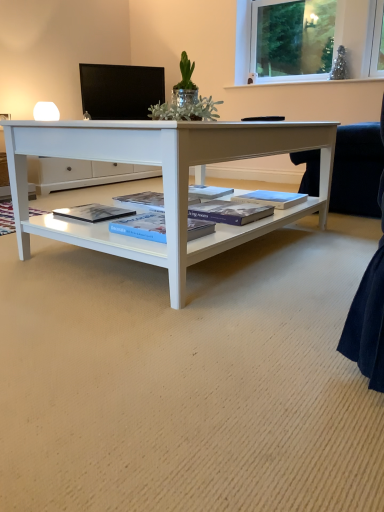
In order to face matte black book at center, which is the 1th magazine in left-to-right order, should I rotate leftwards or rightwards?

Turn left approximately 12.759 degrees to face it.

What do you see at coordinates (272, 198) in the screenshot? The image size is (384, 512). I see `matte blue magazine at center, which ranks as the 4th magazine in left-to-right order` at bounding box center [272, 198].

Find the location of a particular element. The height and width of the screenshot is (512, 384). matte blue magazine at center, which ranks as the 4th magazine in left-to-right order is located at coordinates (272, 198).

How much space does blue glossy book at center, which appears as the 3th magazine when viewed from the right, occupy horizontally?

blue glossy book at center, which appears as the 3th magazine when viewed from the right, is 11.70 inches wide.

The width and height of the screenshot is (384, 512). Find the location of `blue matte book at center, which is counted as the third magazine, starting from the left`. blue matte book at center, which is counted as the third magazine, starting from the left is located at coordinates (229, 212).

At what (x,y) coordinates should I click in order to perform the action: click on matte black book at center, which is the 4th magazine in right-to-left order. Please return your answer as a coordinate pair (x, y). Image resolution: width=384 pixels, height=512 pixels. Looking at the image, I should click on (94, 212).

Is point (88, 71) behind point (121, 226)?

Yes, it is.

There is a black glossy monitor at upper center. Identify the location of the 4th magazine below it (from the image's perspective). The image size is (384, 512). (142, 226).

Is black glossy monitor at upper center taller than blue glossy book at center, which appears as the 3th magazine when viewed from the right?

Yes.

Which object is closer to the camera taking this photo, matte blue magazine at center, which ranks as the first magazine in right-to-left order, or matte black book at center, which is the 4th magazine in right-to-left order?

matte black book at center, which is the 4th magazine in right-to-left order, is more forward.

Looking at this image, could you measure the distance between matte blue magazine at center, which ranks as the 4th magazine in left-to-right order, and matte black book at center, which is the 4th magazine in right-to-left order?

matte blue magazine at center, which ranks as the 4th magazine in left-to-right order, and matte black book at center, which is the 4th magazine in right-to-left order, are 25.66 inches apart from each other.

Between point (267, 198) and point (85, 213), which one is positioned in front?

The point (85, 213) is closer to the camera.

Could matte black book at center, which is the 4th magazine in right-to-left order, be considered to be inside matte blue magazine at center, which ranks as the first magazine in right-to-left order?

No, matte black book at center, which is the 4th magazine in right-to-left order, is located outside of matte blue magazine at center, which ranks as the first magazine in right-to-left order.

Is matte blue magazine at center, which ranks as the first magazine in right-to-left order, looking in the opposite direction of blue glossy book at center, which appears as the 3th magazine when viewed from the right?

That's not correct — matte blue magazine at center, which ranks as the first magazine in right-to-left order, is not looking away from blue glossy book at center, which appears as the 3th magazine when viewed from the right.

Considering the sizes of matte blue magazine at center, which ranks as the first magazine in right-to-left order, and blue glossy book at center, which ranks as the 2th magazine in left-to-right order, in the image, is matte blue magazine at center, which ranks as the first magazine in right-to-left order, taller or shorter than blue glossy book at center, which ranks as the 2th magazine in left-to-right order,?

matte blue magazine at center, which ranks as the first magazine in right-to-left order, is shorter than blue glossy book at center, which ranks as the 2th magazine in left-to-right order.

From the image's perspective, is matte blue magazine at center, which ranks as the 4th magazine in left-to-right order, positioned above or below blue glossy book at center, which appears as the 3th magazine when viewed from the right?

From the image's perspective, matte blue magazine at center, which ranks as the 4th magazine in left-to-right order, appears above blue glossy book at center, which appears as the 3th magazine when viewed from the right.

Who is bigger, matte blue magazine at center, which ranks as the 4th magazine in left-to-right order, or blue glossy book at center, which ranks as the 2th magazine in left-to-right order?

blue glossy book at center, which ranks as the 2th magazine in left-to-right order.

Which is in front, blue matte book at center, acting as the 2th magazine starting from the right, or blue glossy book at center, which ranks as the 2th magazine in left-to-right order?

blue glossy book at center, which ranks as the 2th magazine in left-to-right order, is in front.

Is blue matte book at center, which is counted as the third magazine, starting from the left, facing towards blue glossy book at center, which ranks as the 2th magazine in left-to-right order?

No, blue matte book at center, which is counted as the third magazine, starting from the left, is not aimed at blue glossy book at center, which ranks as the 2th magazine in left-to-right order.

Which of these two, blue matte book at center, acting as the 2th magazine starting from the right, or blue glossy book at center, which ranks as the 2th magazine in left-to-right order, is smaller?

blue matte book at center, acting as the 2th magazine starting from the right.

Considering the sizes of objects clear glass window at upper right and blue matte book at center, which is counted as the third magazine, starting from the left, in the image provided, who is taller, clear glass window at upper right or blue matte book at center, which is counted as the third magazine, starting from the left,?

With more height is clear glass window at upper right.

Is clear glass window at upper right aimed at blue matte book at center, which is counted as the third magazine, starting from the left?

No.

Considering the sizes of objects clear glass window at upper right and blue matte book at center, acting as the 2th magazine starting from the right, in the image provided, who is smaller, clear glass window at upper right or blue matte book at center, acting as the 2th magazine starting from the right,?

Smaller between the two is blue matte book at center, acting as the 2th magazine starting from the right.

Which object is thinner, clear glass window at upper right or blue matte book at center, acting as the 2th magazine starting from the right?

clear glass window at upper right.

Is black glossy monitor at upper center far away from clear glass window at upper right?

That's right, there is a large distance between black glossy monitor at upper center and clear glass window at upper right.

Which object is further away from the camera taking this photo, black glossy monitor at upper center or clear glass window at upper right?

black glossy monitor at upper center.

Which of these two, black glossy monitor at upper center or clear glass window at upper right, is wider?

With larger width is clear glass window at upper right.

Does point (81, 81) lie in front of point (298, 14)?

Yes, it is in front of point (298, 14).

From the picture: In the image, is clear glass window at upper right on the left side or the right side of blue glossy book at center, which ranks as the 2th magazine in left-to-right order?

Based on their positions, clear glass window at upper right is located to the right of blue glossy book at center, which ranks as the 2th magazine in left-to-right order.

Is clear glass window at upper right further to the viewer compared to blue glossy book at center, which ranks as the 2th magazine in left-to-right order?

Yes, clear glass window at upper right is behind blue glossy book at center, which ranks as the 2th magazine in left-to-right order.

This screenshot has width=384, height=512. What are the coordinates of `magazine that is the 4th object located below the black glossy monitor at upper center (from the image's perspective)` in the screenshot? It's located at (142, 226).

From a real-world perspective, which magazine is the 2nd one underneath the matte blue magazine at center, which ranks as the 4th magazine in left-to-right order? Please provide its 2D coordinates.

[(94, 212)]

Estimate the real-world distances between objects in this image. Which object is further from blue glossy book at center, which ranks as the 2th magazine in left-to-right order, matte blue magazine at center, which ranks as the first magazine in right-to-left order, or black glossy monitor at upper center?

black glossy monitor at upper center.

Based on their spatial positions, is blue matte book at center, acting as the 2th magazine starting from the right, or matte blue magazine at center, which ranks as the 4th magazine in left-to-right order, further from matte black book at center, which is the 1th magazine in left-to-right order?

matte blue magazine at center, which ranks as the 4th magazine in left-to-right order, is positioned further to the anchor matte black book at center, which is the 1th magazine in left-to-right order.

When comparing their distances from blue glossy book at center, which ranks as the 2th magazine in left-to-right order, does black glossy monitor at upper center or clear glass window at upper right seem closer?

black glossy monitor at upper center.

Looking at the image, which one is located closer to black glossy monitor at upper center, matte black book at center, which is the 4th magazine in right-to-left order, or blue glossy book at center, which appears as the 3th magazine when viewed from the right?

matte black book at center, which is the 4th magazine in right-to-left order, lies closer to black glossy monitor at upper center than the other object.

Which object lies further to the anchor point blue matte book at center, acting as the 2th magazine starting from the right, matte black book at center, which is the 4th magazine in right-to-left order, or clear glass window at upper right?

Among the two, clear glass window at upper right is located further to blue matte book at center, acting as the 2th magazine starting from the right.

Looking at the image, which one is located closer to blue matte book at center, acting as the 2th magazine starting from the right, blue glossy book at center, which ranks as the 2th magazine in left-to-right order, or clear glass window at upper right?

blue glossy book at center, which ranks as the 2th magazine in left-to-right order, lies closer to blue matte book at center, acting as the 2th magazine starting from the right, than the other object.

When comparing their distances from matte blue magazine at center, which ranks as the 4th magazine in left-to-right order, does black glossy monitor at upper center or matte black book at center, which is the 1th magazine in left-to-right order, seem further?

Based on the image, black glossy monitor at upper center appears to be further to matte blue magazine at center, which ranks as the 4th magazine in left-to-right order.

Which object lies nearer to the anchor point black glossy monitor at upper center, blue matte book at center, which is counted as the third magazine, starting from the left, or matte black book at center, which is the 4th magazine in right-to-left order?

matte black book at center, which is the 4th magazine in right-to-left order, is closer to black glossy monitor at upper center.

The image size is (384, 512). In order to click on magazine between matte black book at center, which is the 4th magazine in right-to-left order, and blue matte book at center, which is counted as the third magazine, starting from the left, from left to right in this screenshot , I will do `click(142, 226)`.

You are a GUI agent. You are given a task and a screenshot of the screen. Output one action in this format:
    pyautogui.click(x=<x>, y=<y>)
    Task: Click on the window screen between blue glossy book at center, which appears as the 3th magazine when viewed from the right, and black glossy monitor at upper center, along the z-axis
    This screenshot has width=384, height=512.
    Given the screenshot: What is the action you would take?
    pyautogui.click(x=293, y=37)

Identify the location of window screen between matte black book at center, which is the 1th magazine in left-to-right order, and black glossy monitor at upper center from front to back. (293, 37).

At what (x,y) coordinates should I click in order to perform the action: click on window screen positioned between matte blue magazine at center, which ranks as the first magazine in right-to-left order, and black glossy monitor at upper center from near to far. Please return your answer as a coordinate pair (x, y). The height and width of the screenshot is (512, 384). Looking at the image, I should click on (293, 37).